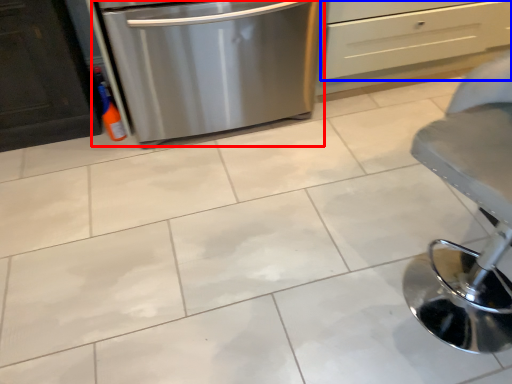
Question: Among these objects, which one is farthest to the camera, home appliance (highlighted by a red box) or drawer (highlighted by a blue box)?

Choices:
 (A) home appliance
 (B) drawer

Answer: (B)